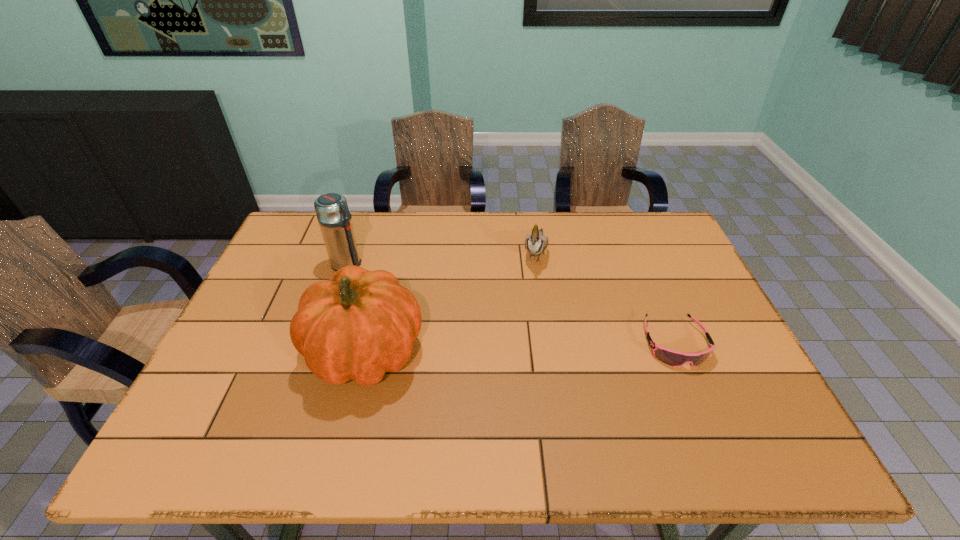
The height and width of the screenshot is (540, 960). I want to click on pumpkin, so click(x=360, y=324).

Where is `the rightmost object`? This screenshot has width=960, height=540. the rightmost object is located at coordinates (673, 358).

Where is `goggles`? The height and width of the screenshot is (540, 960). goggles is located at coordinates (673, 358).

This screenshot has width=960, height=540. Identify the location of thermos bottle. (334, 217).

The height and width of the screenshot is (540, 960). I want to click on the second object from right to left, so pyautogui.click(x=535, y=243).

You are a GUI agent. You are given a task and a screenshot of the screen. Output one action in this format:
    pyautogui.click(x=<x>, y=<y>)
    Task: Click on the bird
    The image size is (960, 540).
    Given the screenshot: What is the action you would take?
    pyautogui.click(x=535, y=243)

Locate an element on the screen. free spot located on the right of the pumpkin is located at coordinates (488, 351).

The height and width of the screenshot is (540, 960). What are the coordinates of `free space located on the front-facing side of the shortest object` in the screenshot? It's located at (693, 388).

You are a GUI agent. You are given a task and a screenshot of the screen. Output one action in this format:
    pyautogui.click(x=<x>, y=<y>)
    Task: Click on the free space located with a handle on the side of the thermos bottle
    This screenshot has height=540, width=960.
    Given the screenshot: What is the action you would take?
    pyautogui.click(x=399, y=286)

Identify the location of free location located 0.160m with a handle on the side of the thermos bottle. Image resolution: width=960 pixels, height=540 pixels. (402, 287).